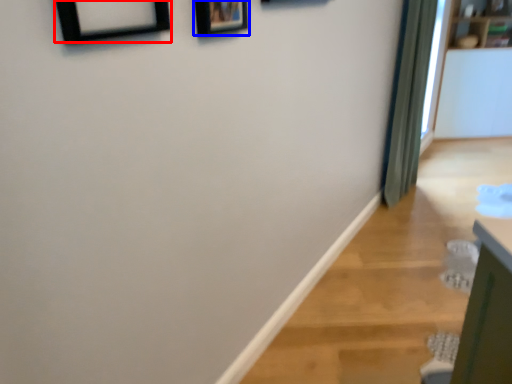
Question: Which point is further to the camera, picture frame (highlighted by a red box) or picture frame (highlighted by a blue box)?

Choices:
 (A) picture frame
 (B) picture frame

Answer: (B)